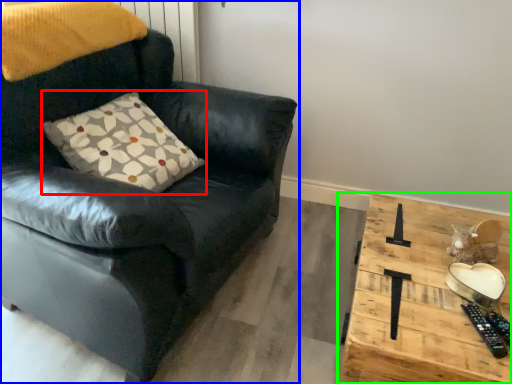
Question: Based on their relative distances, which object is farther from pillow (highlighted by a red box)? Choose from chair (highlighted by a blue box) and table (highlighted by a green box).

Choices:
 (A) chair
 (B) table

Answer: (B)